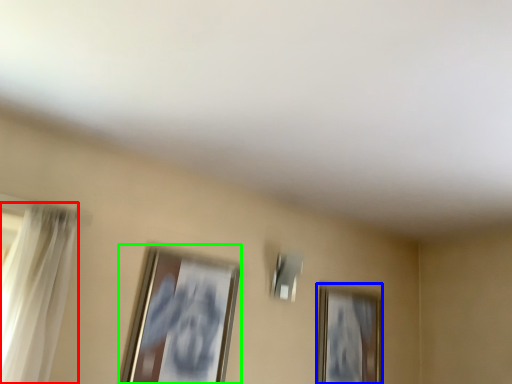
Question: Based on their relative distances, which object is nearer to curtain (highlighted by a red box)? Choose from picture frame (highlighted by a blue box) and picture frame (highlighted by a green box).

Choices:
 (A) picture frame
 (B) picture frame

Answer: (B)